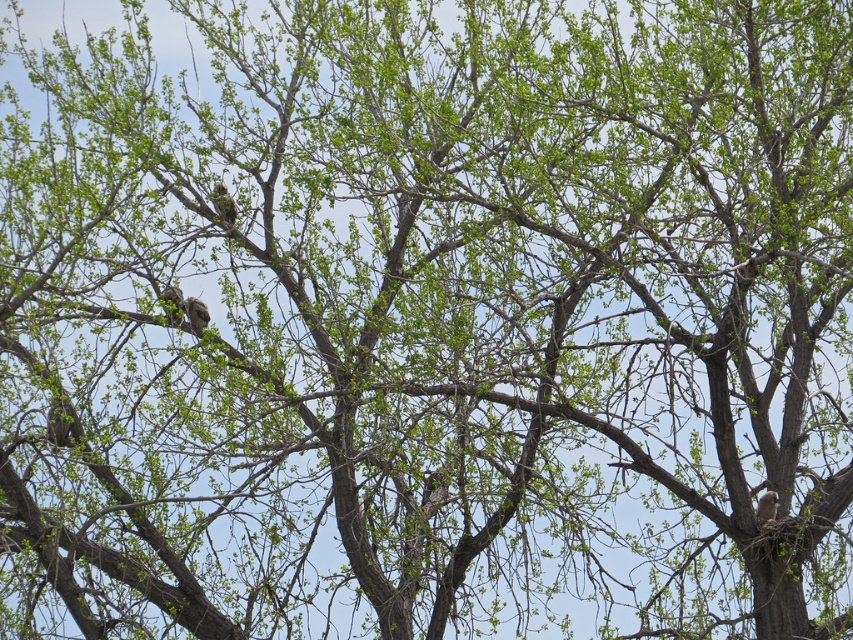
Is brown feathered owl at center closer to camera compared to brown speckled feathers at center?

No.

Is brown feathered owl at center positioned behind brown speckled feathers at center?

Yes, brown feathered owl at center is behind brown speckled feathers at center.

Is point (194, 326) positioned before point (177, 317)?

No.

Identify the location of brown feathered owl at center. (195, 314).

Which is behind, point (219, 200) or point (772, 516)?

The point (219, 200) is more distant.

Is point (219, 204) less distant than point (757, 508)?

That is False.

What do you see at coordinates (223, 204) in the screenshot? This screenshot has width=853, height=640. I see `green textured bird at center` at bounding box center [223, 204].

You are a GUI agent. You are given a task and a screenshot of the screen. Output one action in this format:
    pyautogui.click(x=<x>, y=<y>)
    Task: Click on the green textured bird at center
    This screenshot has height=640, width=853.
    Given the screenshot: What is the action you would take?
    pyautogui.click(x=223, y=204)

Does green textured bird at center have a greater width compared to brown feathered owl at center?

Indeed, green textured bird at center has a greater width compared to brown feathered owl at center.

Describe the element at coordinates (223, 204) in the screenshot. The width and height of the screenshot is (853, 640). I see `green textured bird at center` at that location.

At what (x,y) coordinates should I click in order to perform the action: click on green textured bird at center. Please return your answer as a coordinate pair (x, y). The height and width of the screenshot is (640, 853). Looking at the image, I should click on (223, 204).